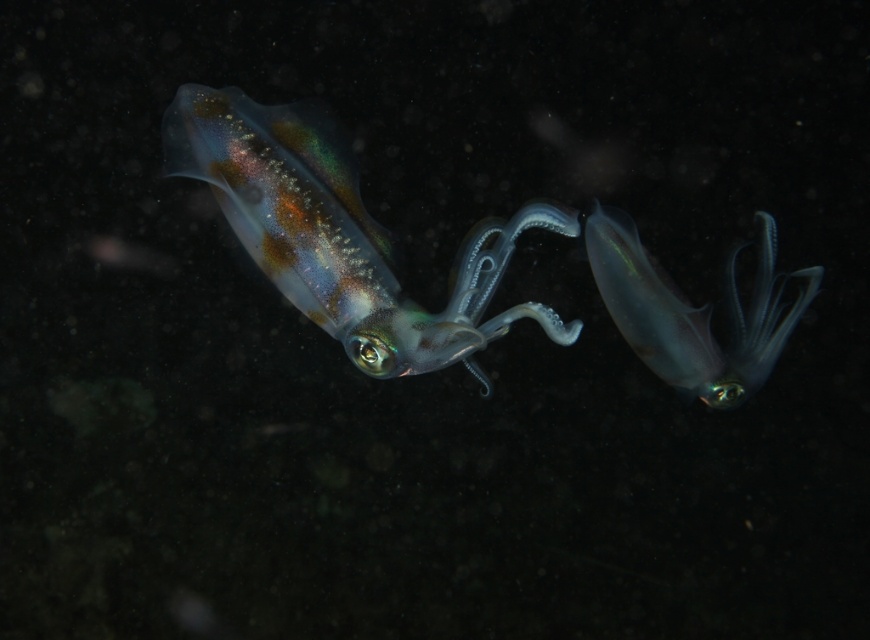
Question: Which point is farther to the camera?

Choices:
 (A) (715, 365)
 (B) (400, 337)

Answer: (A)

Question: Does translucent iridescent squid at center lie behind translucent blue squid at center?

Choices:
 (A) yes
 (B) no

Answer: (B)

Question: Which point is farther from the camera taking this photo?

Choices:
 (A) (333, 195)
 (B) (661, 371)

Answer: (B)

Question: Does translucent iridescent squid at center have a larger size compared to translucent blue squid at center?

Choices:
 (A) yes
 (B) no

Answer: (A)

Question: Does translucent iridescent squid at center lie behind translucent blue squid at center?

Choices:
 (A) no
 (B) yes

Answer: (A)